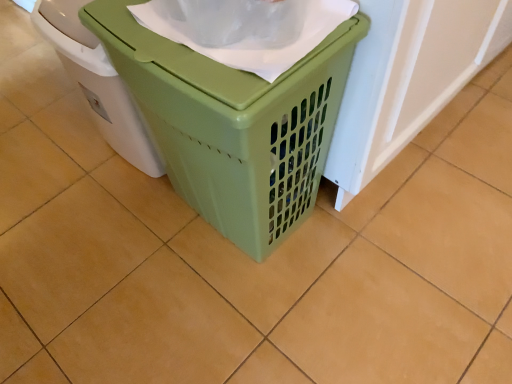
The width and height of the screenshot is (512, 384). Describe the element at coordinates (233, 123) in the screenshot. I see `green plastic laundry basket at center, positioned as the 2th waste container in left-to-right order` at that location.

The height and width of the screenshot is (384, 512). What are the coordinates of `green plastic laundry basket at center, positioned as the 2th waste container in left-to-right order` in the screenshot? It's located at (233, 123).

In order to face green plastic laundry basket at center, positioned as the 2th waste container in left-to-right order, should I rotate leftwards or rightwards?

To face it directly, rotate left by 3.590 degrees.

Locate an element on the screen. This screenshot has width=512, height=384. green plastic laundry basket at center, the second waste container from the right is located at coordinates (97, 82).

This screenshot has height=384, width=512. What do you see at coordinates (97, 82) in the screenshot?
I see `green plastic laundry basket at center, the second waste container from the right` at bounding box center [97, 82].

Identify the location of green plastic laundry basket at center, positioned as the 2th waste container in left-to-right order. (233, 123).

Which object is positioned more to the right, green plastic laundry basket at center, arranged as the first waste container when viewed from the left, or green plastic laundry basket at center, acting as the first waste container starting from the right?

From the viewer's perspective, green plastic laundry basket at center, acting as the first waste container starting from the right, appears more on the right side.

Is green plastic laundry basket at center, the second waste container from the right, further to camera compared to green plastic laundry basket at center, positioned as the 2th waste container in left-to-right order?

Yes, the depth of green plastic laundry basket at center, the second waste container from the right, is greater than that of green plastic laundry basket at center, positioned as the 2th waste container in left-to-right order.

Does point (147, 143) lie behind point (156, 126)?

Yes, point (147, 143) is farther from viewer.

From the image's perspective, would you say green plastic laundry basket at center, the second waste container from the right, is shown under green plastic laundry basket at center, acting as the first waste container starting from the right?

Actually, green plastic laundry basket at center, the second waste container from the right, appears above green plastic laundry basket at center, acting as the first waste container starting from the right, in the image.

From a real-world perspective, which is physically below, green plastic laundry basket at center, the second waste container from the right, or green plastic laundry basket at center, positioned as the 2th waste container in left-to-right order?

green plastic laundry basket at center, the second waste container from the right, from a real-world perspective.

Can you confirm if green plastic laundry basket at center, arranged as the first waste container when viewed from the left, is thinner than green plastic laundry basket at center, acting as the first waste container starting from the right?

Indeed, green plastic laundry basket at center, arranged as the first waste container when viewed from the left, has a lesser width compared to green plastic laundry basket at center, acting as the first waste container starting from the right.

From their relative heights in the image, would you say green plastic laundry basket at center, the second waste container from the right, is taller or shorter than green plastic laundry basket at center, positioned as the 2th waste container in left-to-right order?

Clearly, green plastic laundry basket at center, the second waste container from the right, is shorter compared to green plastic laundry basket at center, positioned as the 2th waste container in left-to-right order.

Looking at the image, does green plastic laundry basket at center, arranged as the first waste container when viewed from the left, seem bigger or smaller compared to green plastic laundry basket at center, positioned as the 2th waste container in left-to-right order?

green plastic laundry basket at center, arranged as the first waste container when viewed from the left, is smaller than green plastic laundry basket at center, positioned as the 2th waste container in left-to-right order.

Would you say green plastic laundry basket at center, arranged as the first waste container when viewed from the left, contains green plastic laundry basket at center, positioned as the 2th waste container in left-to-right order?

Definitely not — green plastic laundry basket at center, positioned as the 2th waste container in left-to-right order, is not inside green plastic laundry basket at center, arranged as the first waste container when viewed from the left.

Is green plastic laundry basket at center, the second waste container from the right, next to green plastic laundry basket at center, positioned as the 2th waste container in left-to-right order?

There is a gap between green plastic laundry basket at center, the second waste container from the right, and green plastic laundry basket at center, positioned as the 2th waste container in left-to-right order.

Is green plastic laundry basket at center, positioned as the 2th waste container in left-to-right order, at the back of green plastic laundry basket at center, arranged as the first waste container when viewed from the left?

green plastic laundry basket at center, arranged as the first waste container when viewed from the left, is not turned away from green plastic laundry basket at center, positioned as the 2th waste container in left-to-right order.

How different are the orientations of green plastic laundry basket at center, arranged as the first waste container when viewed from the left, and green plastic laundry basket at center, positioned as the 2th waste container in left-to-right order, in degrees?

The facing directions of green plastic laundry basket at center, arranged as the first waste container when viewed from the left, and green plastic laundry basket at center, positioned as the 2th waste container in left-to-right order, are 0.000226 degrees apart.

What are the coordinates of `waste container behind the green plastic laundry basket at center, acting as the first waste container starting from the right` in the screenshot? It's located at (97, 82).

From the picture: Considering the relative positions of green plastic laundry basket at center, acting as the first waste container starting from the right, and green plastic laundry basket at center, the second waste container from the right, in the image provided, is green plastic laundry basket at center, acting as the first waste container starting from the right, to the right of green plastic laundry basket at center, the second waste container from the right, from the viewer's perspective?

Yes.

Relative to green plastic laundry basket at center, arranged as the first waste container when viewed from the left, is green plastic laundry basket at center, acting as the first waste container starting from the right, in front or behind?

Clearly, green plastic laundry basket at center, acting as the first waste container starting from the right, is in front of green plastic laundry basket at center, arranged as the first waste container when viewed from the left.

Considering the points (286, 116) and (135, 116), which point is in front, point (286, 116) or point (135, 116)?

The point (286, 116) is closer.

From the image's perspective, does green plastic laundry basket at center, acting as the first waste container starting from the right, appear higher than green plastic laundry basket at center, the second waste container from the right?

No.

From a real-world perspective, relative to green plastic laundry basket at center, arranged as the first waste container when viewed from the left, is green plastic laundry basket at center, positioned as the 2th waste container in left-to-right order, vertically above or below?

From a real-world perspective, green plastic laundry basket at center, positioned as the 2th waste container in left-to-right order, is physically above green plastic laundry basket at center, arranged as the first waste container when viewed from the left.

Does green plastic laundry basket at center, acting as the first waste container starting from the right, have a greater width compared to green plastic laundry basket at center, arranged as the first waste container when viewed from the left?

Correct, the width of green plastic laundry basket at center, acting as the first waste container starting from the right, exceeds that of green plastic laundry basket at center, arranged as the first waste container when viewed from the left.

Considering the relative sizes of green plastic laundry basket at center, acting as the first waste container starting from the right, and green plastic laundry basket at center, arranged as the first waste container when viewed from the left, in the image provided, is green plastic laundry basket at center, acting as the first waste container starting from the right, shorter than green plastic laundry basket at center, arranged as the first waste container when viewed from the left,?

No, green plastic laundry basket at center, acting as the first waste container starting from the right, is not shorter than green plastic laundry basket at center, arranged as the first waste container when viewed from the left.

Is green plastic laundry basket at center, positioned as the 2th waste container in left-to-right order, bigger than green plastic laundry basket at center, the second waste container from the right?

Yes.

Is green plastic laundry basket at center, positioned as the 2th waste container in left-to-right order, inside or outside of green plastic laundry basket at center, the second waste container from the right?

green plastic laundry basket at center, positioned as the 2th waste container in left-to-right order, is spatially situated outside green plastic laundry basket at center, the second waste container from the right.

Is green plastic laundry basket at center, positioned as the 2th waste container in left-to-right order, beside green plastic laundry basket at center, arranged as the first waste container when viewed from the left?

They are not placed beside each other.

Is green plastic laundry basket at center, positioned as the 2th waste container in left-to-right order, facing away from green plastic laundry basket at center, the second waste container from the right?

No, green plastic laundry basket at center, positioned as the 2th waste container in left-to-right order, is not facing the opposite direction of green plastic laundry basket at center, the second waste container from the right.

What's the angular difference between green plastic laundry basket at center, positioned as the 2th waste container in left-to-right order, and green plastic laundry basket at center, the second waste container from the right,'s facing directions?

The angle between the facing direction of green plastic laundry basket at center, positioned as the 2th waste container in left-to-right order, and the facing direction of green plastic laundry basket at center, the second waste container from the right, is 0.000226 degrees.

Find the location of a particular element. The height and width of the screenshot is (384, 512). waste container above the green plastic laundry basket at center, acting as the first waste container starting from the right (from the image's perspective) is located at coordinates (97, 82).

Locate an element on the screen. This screenshot has height=384, width=512. waste container below the green plastic laundry basket at center, arranged as the first waste container when viewed from the left (from the image's perspective) is located at coordinates (233, 123).

There is a green plastic laundry basket at center, the second waste container from the right. At what (x,y) coordinates should I click in order to perform the action: click on waste container above it (from a real-world perspective). Please return your answer as a coordinate pair (x, y). The image size is (512, 384). Looking at the image, I should click on (233, 123).